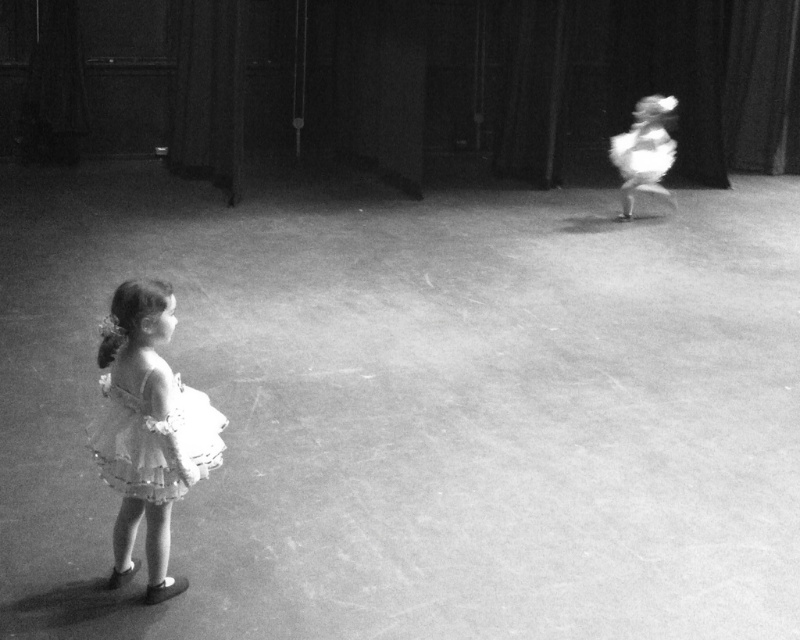
Question: Can you confirm if white fluffy tutu at lower left is positioned to the left of white lace dress at lower left?

Choices:
 (A) no
 (B) yes

Answer: (A)

Question: Which of the following is the farthest from the observer?

Choices:
 (A) (182, 433)
 (B) (150, 484)
 (C) (609, 154)
 (D) (642, 106)

Answer: (C)

Question: Can you confirm if white fluffy tutu at lower left is positioned to the right of white fluffy tutu at upper right?

Choices:
 (A) no
 (B) yes

Answer: (A)

Question: Is white lace dress at lower left smaller than white fluffy dress at upper right?

Choices:
 (A) yes
 (B) no

Answer: (A)

Question: Which point appears closest to the camera in this image?

Choices:
 (A) (662, 109)
 (B) (156, 369)
 (C) (620, 132)

Answer: (B)

Question: Which object appears farthest from the camera in this image?

Choices:
 (A) white fluffy dress at upper right
 (B) white fluffy tutu at lower left
 (C) white fluffy tutu at upper right
 (D) white lace dress at lower left

Answer: (A)